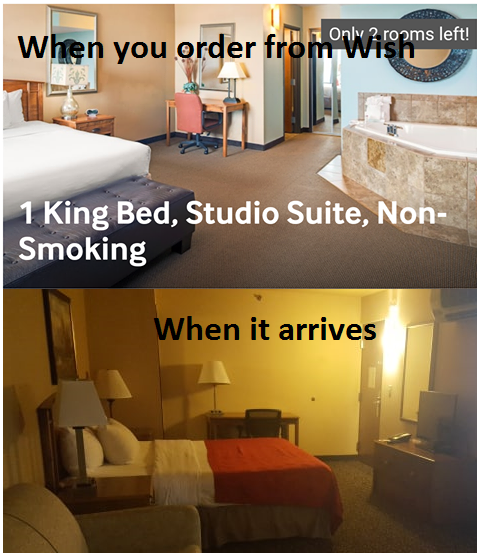
Locate an element on the screen. The width and height of the screenshot is (477, 553). tv is located at coordinates (444, 404).